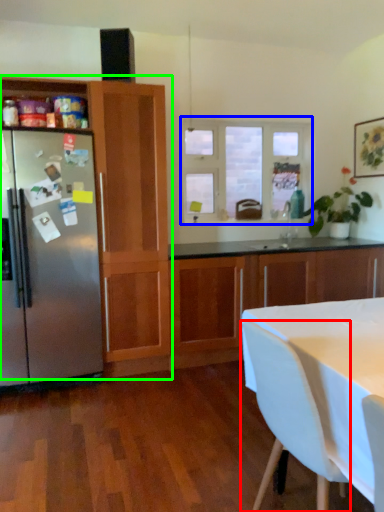
Question: Considering the real-world distances, which object is farthest from chair (highlighted by a red box)? window (highlighted by a blue box) or cabinetry (highlighted by a green box)?

Choices:
 (A) window
 (B) cabinetry

Answer: (A)